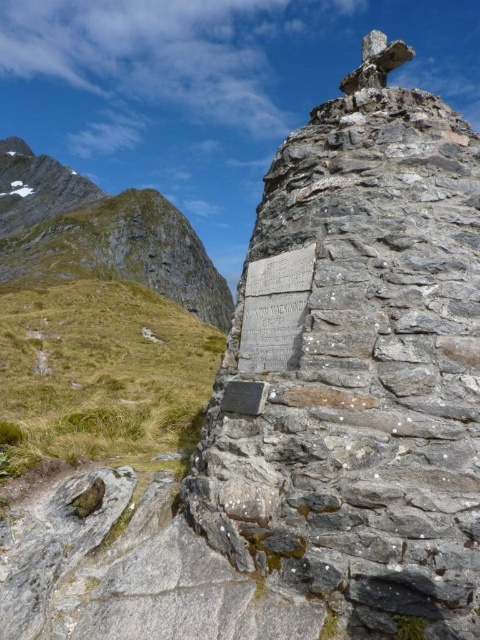
In the scene shown: You are a hiker standing at the base of the rugged stone mountain at upper left and want to reach the gray stone monument at center. Which direction should you move to get closer to the monument?

The gray stone monument at center is lower in height than the rugged stone mountain at upper left. To reach it, you should move downward from the mountain towards the monument.